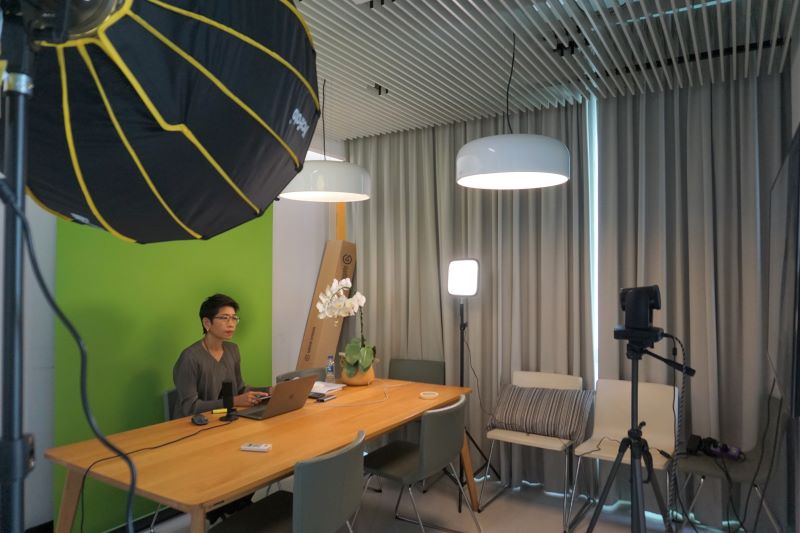
Identify the location of electrical cords. This screenshot has height=533, width=800. (110, 467), (124, 449), (484, 395).